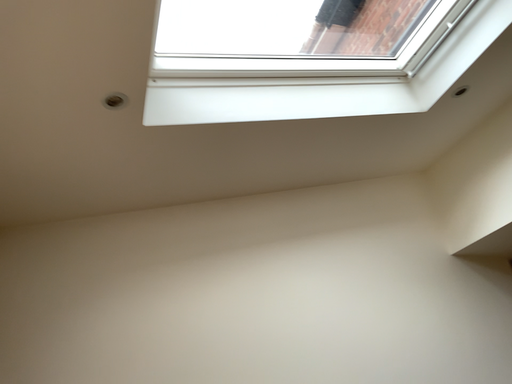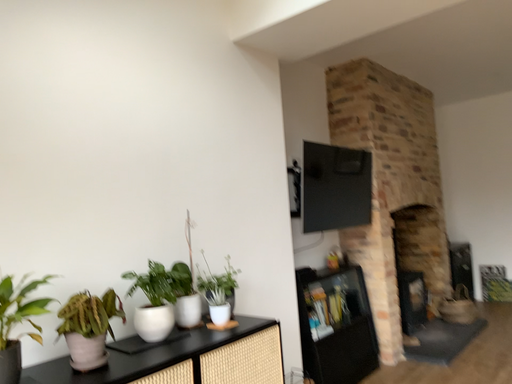
Question: Which way did the camera rotate in the video?

Choices:
 (A) rotated right
 (B) rotated left

Answer: (A)